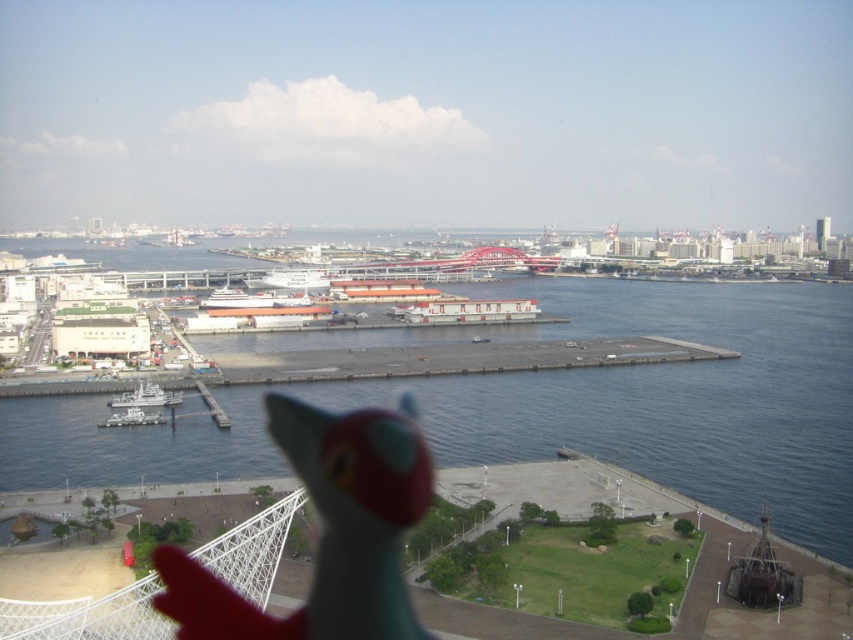
You are a harbor tour guide explaining the ships in the image. You point out the white matte ship at center and the white glossy ship at lower left. Which ship is positioned further to the left?

The white matte ship at center is positioned further to the left than the white glossy ship at lower left.

You are a photographer standing at the harbor and want to capture a photo of the blue water at center and the white glossy ship at lower left. Which object will appear closer to the camera in the photo?

The blue water at center appears closer to the camera because it is in front of the white glossy ship at lower left.